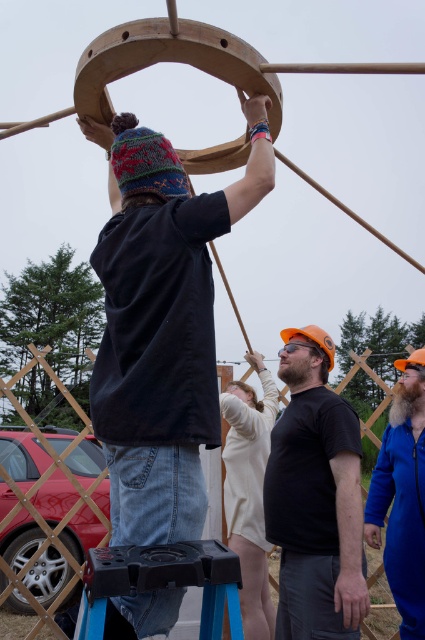
Is black matte helmet at center to the left of blue fuzzy beanie at upper left from the viewer's perspective?

Indeed, black matte helmet at center is positioned on the left side of blue fuzzy beanie at upper left.

Find the location of `black matte helmet at center`. black matte helmet at center is located at coordinates (316, 497).

Does point (183, 474) come closer to viewer compared to point (147, 570)?

That is False.

Is knitted wool beanie at upper left thinner than black plastic stool at lower center?

Incorrect, knitted wool beanie at upper left's width is not less than black plastic stool at lower center's.

This screenshot has width=425, height=640. Describe the element at coordinates (163, 324) in the screenshot. I see `knitted wool beanie at upper left` at that location.

Locate an element on the screen. The image size is (425, 640). knitted wool beanie at upper left is located at coordinates (163, 324).

Is black matte helmet at center thinner than black plastic stool at lower center?

Correct, black matte helmet at center's width is less than black plastic stool at lower center's.

Does black matte helmet at center come behind black plastic stool at lower center?

Yes, it is behind black plastic stool at lower center.

Is point (291, 513) positioned in front of point (135, 548)?

No, it is not.

Image resolution: width=425 pixels, height=640 pixels. What are the coordinates of `black matte helmet at center` in the screenshot? It's located at (316, 497).